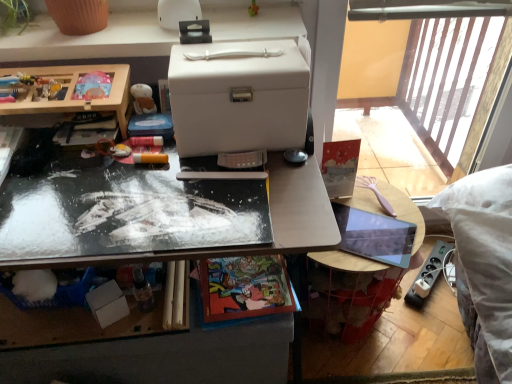
The image size is (512, 384). What are the coordinates of `vacant space situated above white matte box at center (from a real-world perspective)` in the screenshot? It's located at (242, 55).